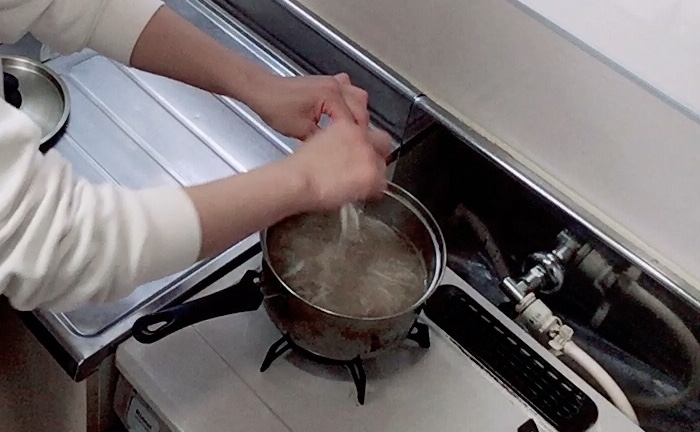
The height and width of the screenshot is (432, 700). I want to click on countertop grooves, so click(x=105, y=171), click(x=147, y=146), click(x=182, y=120), click(x=237, y=109).